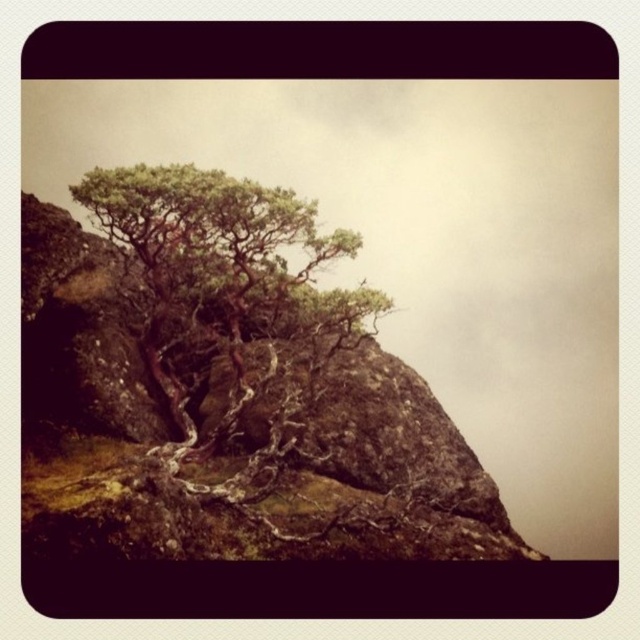
Between green mossy rock at upper center and green textured tree at center, which one has more height?

Standing taller between the two is green mossy rock at upper center.

Between green mossy rock at upper center and green textured tree at center, which one is positioned higher?

green textured tree at center is above.

Locate an element on the screen. Image resolution: width=640 pixels, height=640 pixels. green mossy rock at upper center is located at coordinates (230, 436).